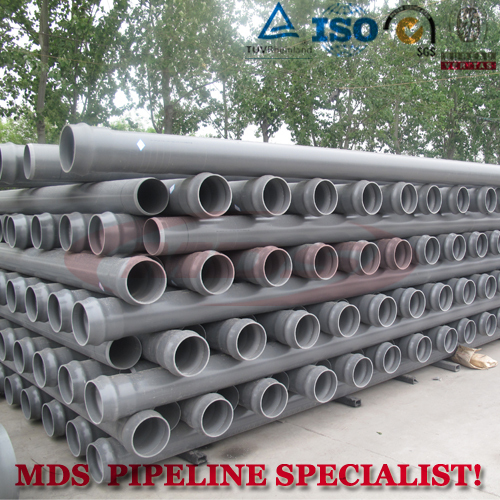
Find the location of a particular element. The height and width of the screenshot is (500, 500). visible pipes in top row is located at coordinates (3, 155), (42, 164), (124, 146).